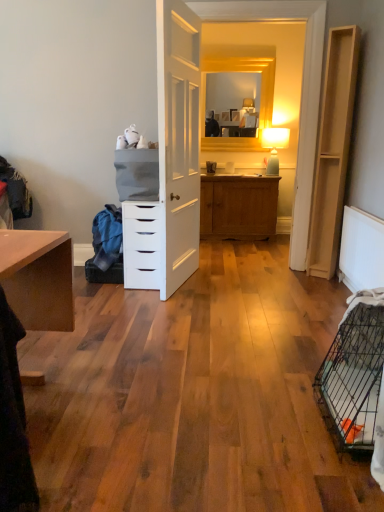
You are a GUI agent. You are given a task and a screenshot of the screen. Output one action in this format:
    pyautogui.click(x=<x>, y=<y>)
    Task: Click on the free space in front of white matte chest of drawers at center
    This screenshot has width=384, height=512.
    Given the screenshot: What is the action you would take?
    pyautogui.click(x=146, y=300)